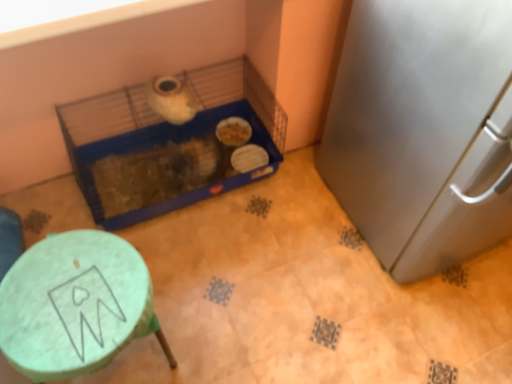
In order to click on blue plastic bird cage at center in this screenshot , I will do `click(168, 144)`.

The width and height of the screenshot is (512, 384). What are the coordinates of `satin silver refrigerator at right` in the screenshot? It's located at (421, 130).

Can you confirm if blue plastic bird cage at center is bigger than satin silver refrigerator at right?

No.

Is blue plastic bird cage at center surrounding satin silver refrigerator at right?

No, satin silver refrigerator at right is not a part of blue plastic bird cage at center.

From the image's perspective, which one is positioned lower, blue plastic bird cage at center or satin silver refrigerator at right?

blue plastic bird cage at center is shown below in the image.

Where is `bird cage to the left of satin silver refrigerator at right`? This screenshot has width=512, height=384. bird cage to the left of satin silver refrigerator at right is located at coordinates (168, 144).

Is dark brown textured bedding at center positioned with its back to blue plastic bird cage at center?

Yes.

From the image's perspective, which one is positioned higher, dark brown textured bedding at center or blue plastic bird cage at center?

From the image's view, blue plastic bird cage at center is above.

Which of these two, dark brown textured bedding at center or blue plastic bird cage at center, is smaller?

With smaller size is dark brown textured bedding at center.

Considering the sizes of objects green matte stool at lower left and satin silver refrigerator at right in the image provided, who is smaller, green matte stool at lower left or satin silver refrigerator at right?

With smaller size is green matte stool at lower left.

Which is more distant, (160, 341) or (417, 158)?

The point (160, 341) is farther from the camera.

Which of these two, green matte stool at lower left or satin silver refrigerator at right, stands taller?

satin silver refrigerator at right is taller.

Is green matte stool at lower left in contact with blue plastic bird cage at center?

green matte stool at lower left and blue plastic bird cage at center are clearly separated.

This screenshot has width=512, height=384. I want to click on furniture located in front of the blue plastic bird cage at center, so click(75, 305).

Which is in front, point (47, 335) or point (160, 140)?

The point (47, 335) is more forward.

Based on the photo, is green matte stool at lower left facing towards blue plastic bird cage at center?

No, green matte stool at lower left is not oriented towards blue plastic bird cage at center.

Considering the sizes of objects dark brown textured bedding at center and green matte stool at lower left in the image provided, who is thinner, dark brown textured bedding at center or green matte stool at lower left?

With smaller width is dark brown textured bedding at center.

Between dark brown textured bedding at center and green matte stool at lower left, which one has smaller size?

dark brown textured bedding at center is smaller.

You are a GUI agent. You are given a task and a screenshot of the screen. Output one action in this format:
    pyautogui.click(x=<x>, y=<y>)
    Task: Click on the furniture in front of the dark brown textured bedding at center
    The image size is (512, 384).
    Given the screenshot: What is the action you would take?
    pyautogui.click(x=75, y=305)

Which object is positioned more to the right, dark brown textured bedding at center or green matte stool at lower left?

Positioned to the right is dark brown textured bedding at center.

Between blue plastic bird cage at center and dark brown textured bedding at center, which one has smaller size?

dark brown textured bedding at center is smaller.

Can you confirm if blue plastic bird cage at center is shorter than dark brown textured bedding at center?

Incorrect, the height of blue plastic bird cage at center does not fall short of that of dark brown textured bedding at center.

From a real-world perspective, which object stands above the other?

blue plastic bird cage at center.

At what (x,y) coordinates should I click in order to perform the action: click on appliance to the right of blue plastic bird cage at center. Please return your answer as a coordinate pair (x, y). Image resolution: width=512 pixels, height=384 pixels. Looking at the image, I should click on (421, 130).

How many degrees apart are the facing directions of satin silver refrigerator at right and blue plastic bird cage at center?

They differ by 0.825 degrees in their facing directions.

How distant is satin silver refrigerator at right from blue plastic bird cage at center?

The distance of satin silver refrigerator at right from blue plastic bird cage at center is 22.03 inches.

From a real-world perspective, between satin silver refrigerator at right and blue plastic bird cage at center, who is vertically lower?

From a 3D spatial view, blue plastic bird cage at center is below.

What are the coordinates of `appliance on the right of blue plastic bird cage at center` in the screenshot? It's located at [x=421, y=130].

At what (x,y) coordinates should I click in order to perform the action: click on bird cage in front of the dark brown textured bedding at center. Please return your answer as a coordinate pair (x, y). This screenshot has height=384, width=512. Looking at the image, I should click on (168, 144).

Estimate the real-world distances between objects in this image. Which object is closer to blue plastic bird cage at center, dark brown textured bedding at center or green matte stool at lower left?

dark brown textured bedding at center is closer to blue plastic bird cage at center.

Based on their spatial positions, is green matte stool at lower left or dark brown textured bedding at center closer to satin silver refrigerator at right?

dark brown textured bedding at center lies closer to satin silver refrigerator at right than the other object.

Based on their spatial positions, is satin silver refrigerator at right or dark brown textured bedding at center closer to blue plastic bird cage at center?

The object closer to blue plastic bird cage at center is dark brown textured bedding at center.

Looking at this image, estimate the real-world distances between objects in this image. Which object is closer to satin silver refrigerator at right, dark brown textured bedding at center or green matte stool at lower left?

The object closer to satin silver refrigerator at right is dark brown textured bedding at center.

In the scene shown: Which object lies further to the anchor point dark brown textured bedding at center, satin silver refrigerator at right or blue plastic bird cage at center?

Based on the image, satin silver refrigerator at right appears to be further to dark brown textured bedding at center.

From the image, which object appears to be nearer to dark brown textured bedding at center, green matte stool at lower left or satin silver refrigerator at right?

green matte stool at lower left.

Which object lies nearer to the anchor point satin silver refrigerator at right, dark brown textured bedding at center or blue plastic bird cage at center?

blue plastic bird cage at center is closer to satin silver refrigerator at right.

Considering their positions, is green matte stool at lower left positioned closer to satin silver refrigerator at right than blue plastic bird cage at center?

Based on the image, blue plastic bird cage at center appears to be nearer to satin silver refrigerator at right.

Find the location of a particular element. The image size is (512, 384). bird cage located between dark brown textured bedding at center and satin silver refrigerator at right in the left-right direction is located at coordinates (168, 144).

The height and width of the screenshot is (384, 512). What are the coordinates of `bird cage between green matte stool at lower left and dark brown textured bedding at center from front to back` in the screenshot? It's located at (168, 144).

What are the coordinates of `bird cage located between green matte stool at lower left and satin silver refrigerator at right in the left-right direction` in the screenshot? It's located at (168, 144).

I want to click on animal located between green matte stool at lower left and satin silver refrigerator at right in the left-right direction, so click(x=158, y=173).